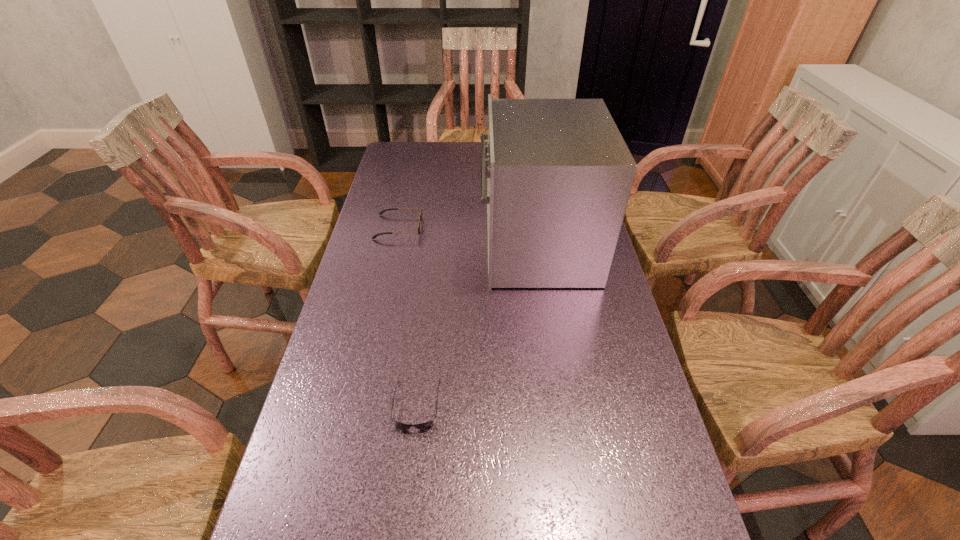
Identify the location of vacant space situated 0.130m on the front-facing side of the shortest object. The width and height of the screenshot is (960, 540). (406, 498).

Locate an element on the screen. This screenshot has height=540, width=960. object present at the left edge is located at coordinates (421, 215).

Locate an element on the screen. The image size is (960, 540). object that is at the right edge is located at coordinates 559,174.

I want to click on vacant space at the far edge of the desktop, so click(478, 172).

Image resolution: width=960 pixels, height=540 pixels. What are the coordinates of `free location at the left edge of the desktop` in the screenshot? It's located at (413, 174).

Where is `vacant space at the right edge of the desktop`? This screenshot has width=960, height=540. vacant space at the right edge of the desktop is located at coordinates (605, 410).

The height and width of the screenshot is (540, 960). Find the location of `free region at the far left corner of the desktop`. free region at the far left corner of the desktop is located at coordinates (415, 156).

Locate an element on the screen. This screenshot has height=540, width=960. free spot between the right sunglasses and the toaster oven is located at coordinates (476, 326).

This screenshot has height=540, width=960. I want to click on vacant area between the right sunglasses and the taller sunglasses, so click(x=408, y=316).

This screenshot has width=960, height=540. Identify the location of vacant point located between the toaster oven and the farther sunglasses. (468, 237).